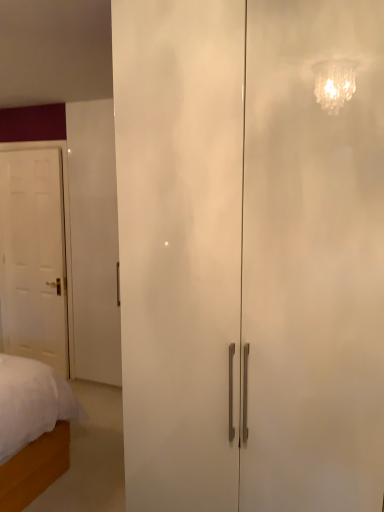
Question: From the image's perspective, does white matte door at left, marked as the 2th door in a front-to-back arrangement, appear lower than white glossy cabinet at center, which is the first door in right-to-left order?

Choices:
 (A) no
 (B) yes

Answer: (A)

Question: Is white matte door at left, the first door when ordered from back to front, bigger than white glossy cabinet at center, which is the first door in right-to-left order?

Choices:
 (A) yes
 (B) no

Answer: (B)

Question: Is white matte door at left, marked as the 2th door in a front-to-back arrangement, positioned far away from white glossy cabinet at center, the second door in the back-to-front sequence?

Choices:
 (A) yes
 (B) no

Answer: (A)

Question: Does white matte door at left, acting as the second door starting from the right, appear on the right side of white glossy cabinet at center, which is the first door in right-to-left order?

Choices:
 (A) no
 (B) yes

Answer: (A)

Question: From the image's perspective, does white matte door at left, the first door when ordered from back to front, appear higher than white glossy cabinet at center, the first door when ordered from front to back?

Choices:
 (A) yes
 (B) no

Answer: (A)

Question: Considering the relative sizes of white matte door at left, marked as the 2th door in a front-to-back arrangement, and white glossy cabinet at center, the first door when ordered from front to back, in the image provided, is white matte door at left, marked as the 2th door in a front-to-back arrangement, thinner than white glossy cabinet at center, the first door when ordered from front to back,?

Choices:
 (A) no
 (B) yes

Answer: (B)

Question: Considering the relative positions of white glossy cabinet at center, the second door from the left, and white matte door at left, which is counted as the first door, starting from the left, in the image provided, is white glossy cabinet at center, the second door from the left, to the left of white matte door at left, which is counted as the first door, starting from the left, from the viewer's perspective?

Choices:
 (A) yes
 (B) no

Answer: (B)

Question: Would you say white glossy cabinet at center, which is the first door in right-to-left order, is outside white matte door at left, acting as the second door starting from the right?

Choices:
 (A) no
 (B) yes

Answer: (B)

Question: Can you confirm if white glossy cabinet at center, the second door in the back-to-front sequence, is wider than white matte door at left, marked as the 2th door in a front-to-back arrangement?

Choices:
 (A) yes
 (B) no

Answer: (A)

Question: Is white glossy cabinet at center, which is the first door in right-to-left order, not near white matte door at left, which is counted as the first door, starting from the left?

Choices:
 (A) no
 (B) yes

Answer: (B)

Question: Is white glossy cabinet at center, which is the first door in right-to-left order, thinner than white matte door at left, the first door when ordered from back to front?

Choices:
 (A) no
 (B) yes

Answer: (A)

Question: Is white glossy cabinet at center, the first door when ordered from front to back, shorter than white matte door at left, acting as the second door starting from the right?

Choices:
 (A) yes
 (B) no

Answer: (B)

Question: Is point (302, 103) positioned closer to the camera than point (59, 228)?

Choices:
 (A) farther
 (B) closer

Answer: (B)